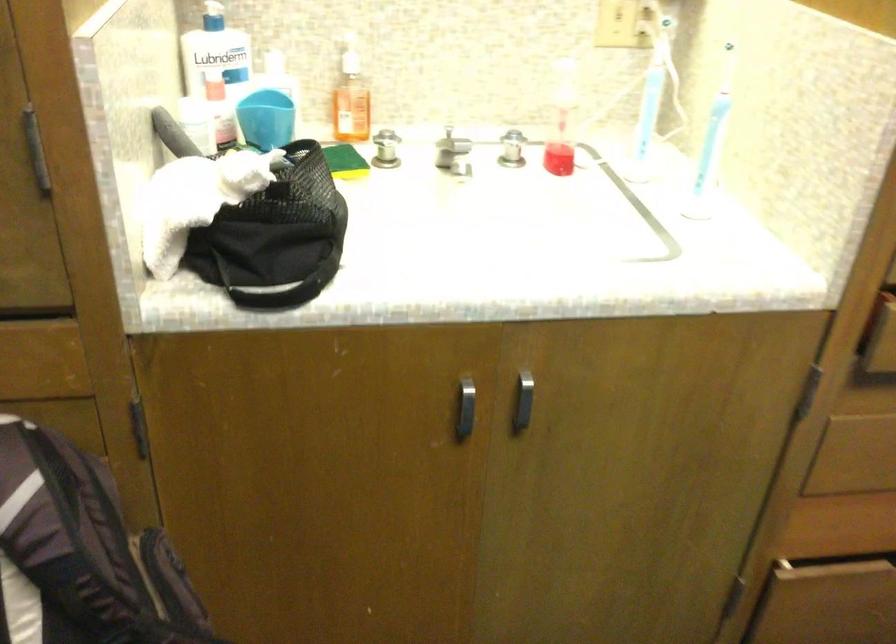
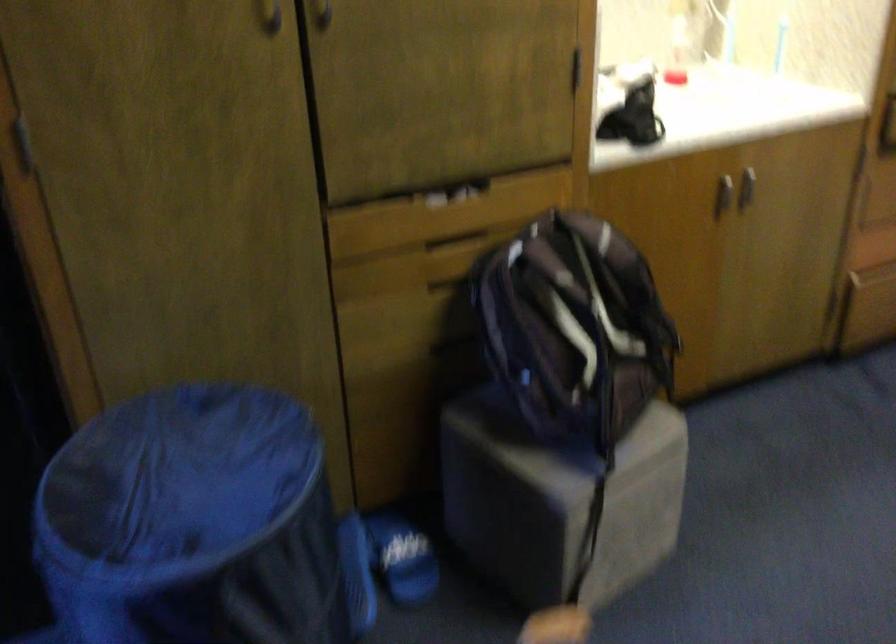
Locate, in the second image, the point that corresponds to point (476, 412) in the first image.

(722, 194)